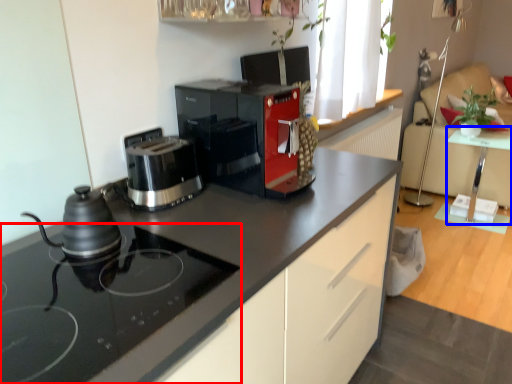
Question: Which object is further to the camera taking this photo, home appliance (highlighted by a red box) or table (highlighted by a blue box)?

Choices:
 (A) home appliance
 (B) table

Answer: (B)